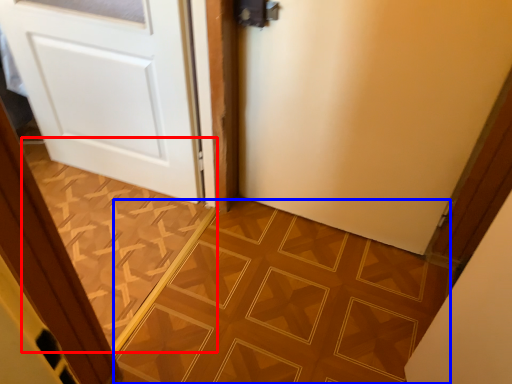
Question: Which point is further to the camera, ceramic tile (highlighted by a red box) or ceramic tile (highlighted by a blue box)?

Choices:
 (A) ceramic tile
 (B) ceramic tile

Answer: (A)